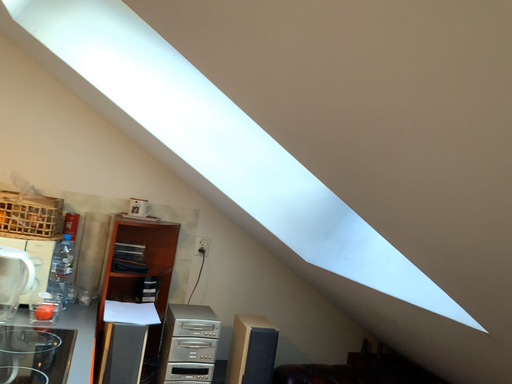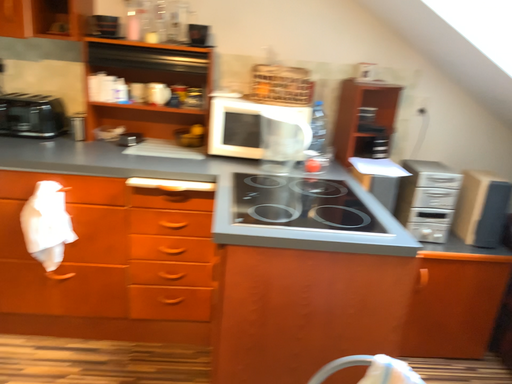
Question: How did the camera likely rotate when shooting the video?

Choices:
 (A) rotated downward
 (B) rotated upward

Answer: (A)